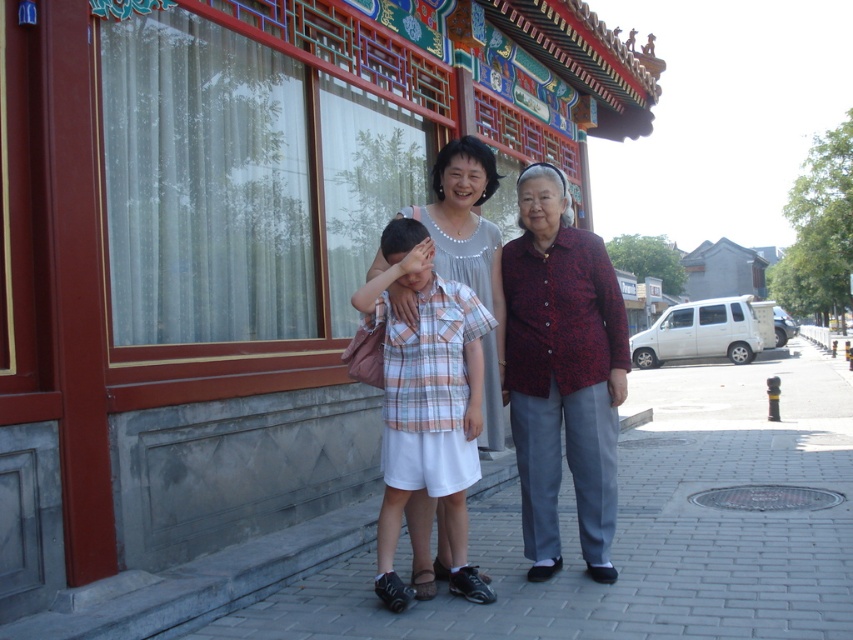
Can you confirm if red textured blazer at right is bigger than plaid cotton shirt at center?

Yes, red textured blazer at right is bigger than plaid cotton shirt at center.

Is red textured blazer at right thinner than plaid cotton shirt at center?

Yes, red textured blazer at right is thinner than plaid cotton shirt at center.

Is point (595, 529) positioned before point (480, 424)?

No, it is behind (480, 424).

I want to click on red textured blazer at right, so click(x=561, y=372).

Is point (583, 310) closer to viewer compared to point (477, 428)?

That is False.

Is matte plaid shirt at center to the right of plaid cotton shirt at center from the viewer's perspective?

Yes, matte plaid shirt at center is to the right of plaid cotton shirt at center.

At what (x,y) coordinates should I click in order to perform the action: click on matte plaid shirt at center. Please return your answer as a coordinate pair (x, y). Looking at the image, I should click on (560, 369).

Describe the element at coordinates (560, 369) in the screenshot. I see `matte plaid shirt at center` at that location.

Which is more to the right, matte plaid shirt at center or red textured blazer at right?

red textured blazer at right is more to the right.

Is point (544, 477) farther from camera compared to point (583, 512)?

That is True.

At what (x,y) coordinates should I click in order to perform the action: click on matte plaid shirt at center. Please return your answer as a coordinate pair (x, y). This screenshot has width=853, height=640. Looking at the image, I should click on (560, 369).